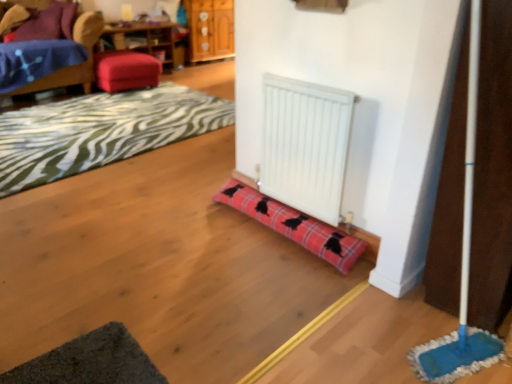
Question: Does red plaid doorstop at center have a greater height compared to wooden table at upper left?

Choices:
 (A) no
 (B) yes

Answer: (A)

Question: From the image's perspective, is red plaid doorstop at center under wooden table at upper left?

Choices:
 (A) yes
 (B) no

Answer: (A)

Question: Can you confirm if red plaid doorstop at center is wider than wooden table at upper left?

Choices:
 (A) no
 (B) yes

Answer: (A)

Question: Is red plaid doorstop at center shorter than wooden table at upper left?

Choices:
 (A) yes
 (B) no

Answer: (A)

Question: From a real-world perspective, does red plaid doorstop at center sit lower than wooden table at upper left?

Choices:
 (A) no
 (B) yes

Answer: (B)

Question: From a real-world perspective, is red plaid doorstop at center physically above wooden table at upper left?

Choices:
 (A) no
 (B) yes

Answer: (A)

Question: From a real-world perspective, does wooden dresser at upper center sit lower than wooden table at upper left?

Choices:
 (A) no
 (B) yes

Answer: (A)

Question: From the image's perspective, is wooden dresser at upper center under wooden table at upper left?

Choices:
 (A) no
 (B) yes

Answer: (A)

Question: Considering the relative sizes of wooden dresser at upper center and wooden table at upper left in the image provided, is wooden dresser at upper center smaller than wooden table at upper left?

Choices:
 (A) yes
 (B) no

Answer: (B)

Question: Considering the relative positions of wooden dresser at upper center and wooden table at upper left in the image provided, is wooden dresser at upper center to the right of wooden table at upper left from the viewer's perspective?

Choices:
 (A) yes
 (B) no

Answer: (A)

Question: Does wooden dresser at upper center have a lesser height compared to wooden table at upper left?

Choices:
 (A) no
 (B) yes

Answer: (A)

Question: Is wooden table at upper left completely or partially inside wooden dresser at upper center?

Choices:
 (A) yes
 (B) no

Answer: (B)

Question: Is dark gray textured yoga mat at lower left positioned with its back to wooden dresser at upper center?

Choices:
 (A) no
 (B) yes

Answer: (A)